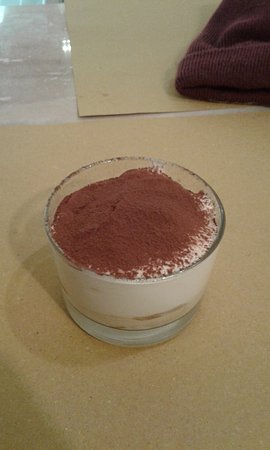
In order to click on glass in this screenshot , I will do `click(142, 301)`.